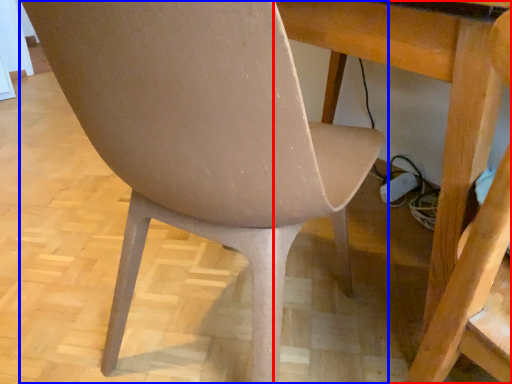
Question: Which of the following is the farthest to the observer, table (highlighted by a red box) or chair (highlighted by a blue box)?

Choices:
 (A) table
 (B) chair

Answer: (A)